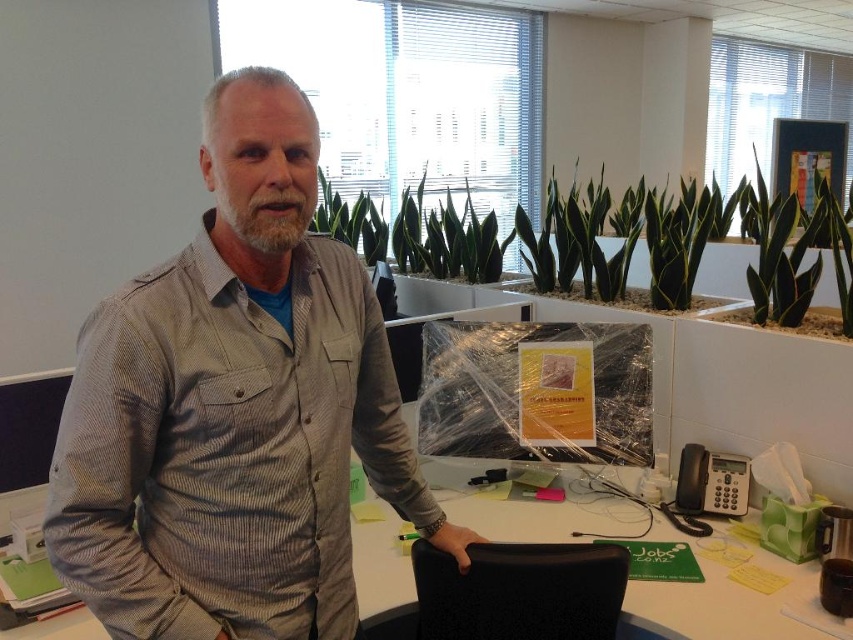
Is gray striped shirt at center further to the viewer compared to black textured swivel chair at center?

No, it is not.

In order to click on gray striped shirt at center in this screenshot , I will do [234, 408].

The width and height of the screenshot is (853, 640). Identify the location of gray striped shirt at center. (234, 408).

Between green leafy plant at center and black textured swivel chair at center, which one is positioned lower?

black textured swivel chair at center is lower down.

Can you confirm if green leafy plant at center is taller than black textured swivel chair at center?

Indeed, green leafy plant at center has a greater height compared to black textured swivel chair at center.

Does point (735, 198) come closer to viewer compared to point (468, 627)?

No, it is not.

This screenshot has width=853, height=640. I want to click on green leafy plant at center, so click(x=618, y=250).

Is white plastic table at center thinner than black textured swivel chair at center?

Incorrect, white plastic table at center's width is not less than black textured swivel chair at center's.

Locate an element on the screen. white plastic table at center is located at coordinates (724, 595).

Who is more forward, (374, 547) or (419, 588)?

Point (419, 588) is more forward.

Where is `white plastic table at center`? white plastic table at center is located at coordinates (724, 595).